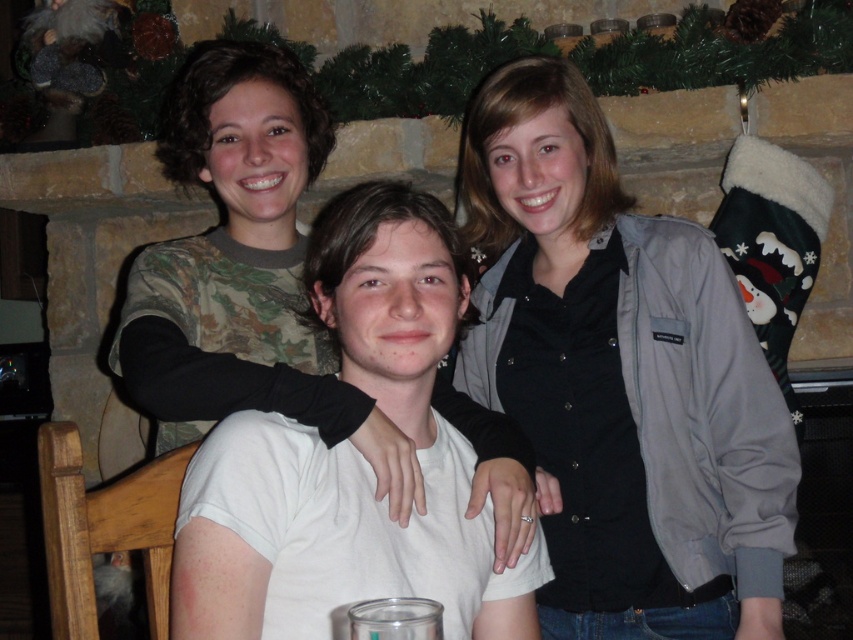
Question: Which point is farther to the camera?

Choices:
 (A) (548, 349)
 (B) (225, 602)

Answer: (A)

Question: Does gray fabric jacket at upper right come behind white matte t-shirt at center?

Choices:
 (A) no
 (B) yes

Answer: (B)

Question: Can you confirm if gray fabric jacket at upper right is positioned below white matte t-shirt at center?

Choices:
 (A) yes
 (B) no

Answer: (B)

Question: Is gray fabric jacket at upper right thinner than white matte t-shirt at center?

Choices:
 (A) no
 (B) yes

Answer: (A)

Question: Among these points, which one is farthest from the camera?

Choices:
 (A) (426, 296)
 (B) (689, 384)

Answer: (B)